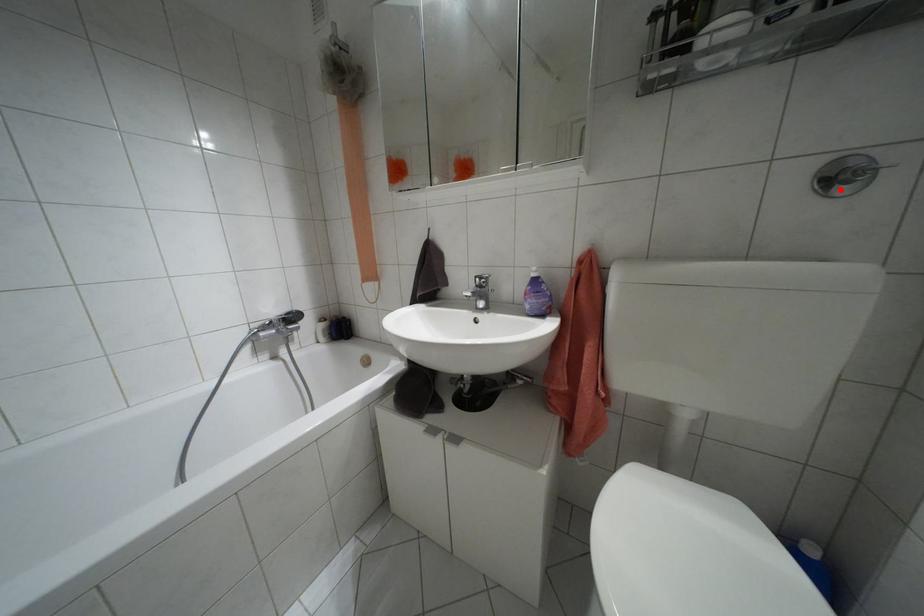
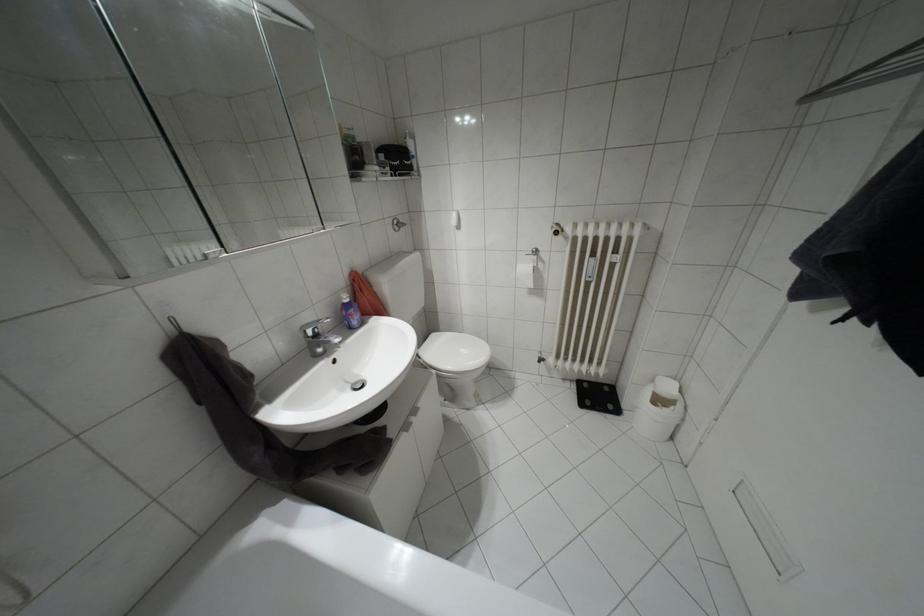
Question: I am providing you with two images of the same scene from different viewpoints. A red point is shown in image1. For the corresponding object point in image2, is it positioned nearer or farther from the camera?

Choices:
 (A) Nearer
 (B) Farther

Answer: (A)